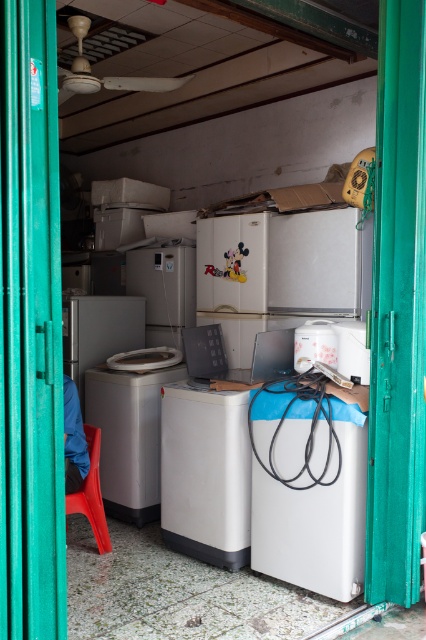
From the picture: You are trying to access the white glossy washing machine at center but there is a green fabric curtain at left in the way. Can you move the curtain to reach the washing machine?

The green fabric curtain at left is in front of the white glossy washing machine at center, so you can move the curtain to access the washing machine.

You are trying to reach the white plastic toaster at center from the red plastic chair at lower left. Can you walk directly to it without moving any objects?

The red plastic chair at lower left and white plastic toaster at center are 4.01 feet apart from each other, so yes, you can walk directly to the white plastic toaster at center without moving any objects since the distance is sufficient for walking.